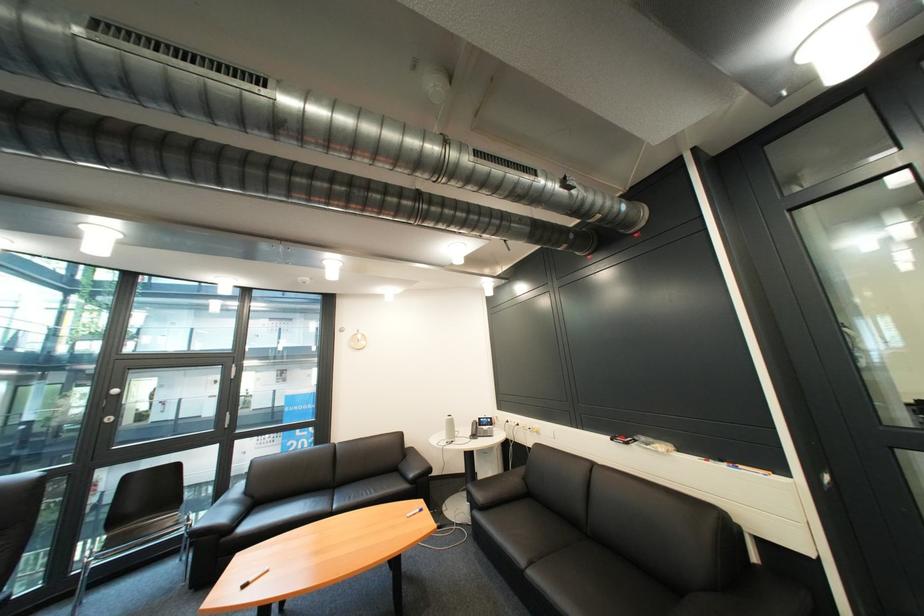
The image size is (924, 616). In order to click on phone handset in this screenshot , I will do `click(481, 427)`.